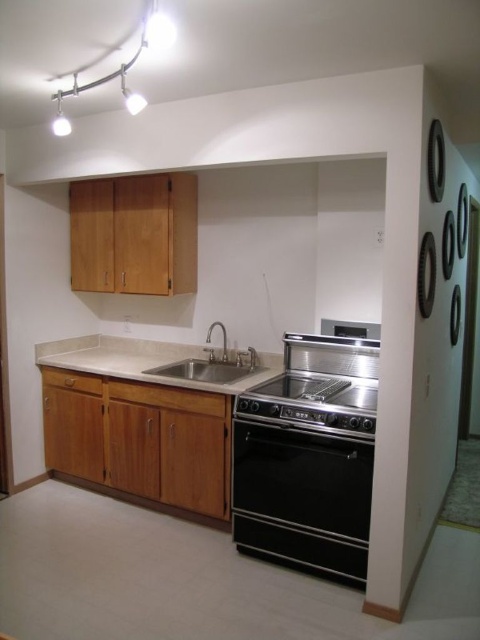
Can you confirm if stainless steel oven at center is shorter than satin steel sink at center?

Indeed, stainless steel oven at center has a lesser height compared to satin steel sink at center.

Is stainless steel oven at center wider than satin steel sink at center?

Indeed, stainless steel oven at center has a greater width compared to satin steel sink at center.

The height and width of the screenshot is (640, 480). I want to click on stainless steel oven at center, so click(312, 403).

Does satin steel sink at center appear on the right side of silver metallic faucet at center?

No, satin steel sink at center is not to the right of silver metallic faucet at center.

Does point (241, 365) come behind point (211, 328)?

No, it is in front of (211, 328).

At what (x,y) coordinates should I click in order to perform the action: click on satin steel sink at center. Please return your answer as a coordinate pair (x, y). The image size is (480, 640). Looking at the image, I should click on (213, 364).

Does black stainless steel oven at center lie in front of silver metallic faucet at center?

Yes, it is in front of silver metallic faucet at center.

Can you confirm if black stainless steel oven at center is thinner than silver metallic faucet at center?

Incorrect, black stainless steel oven at center's width is not less than silver metallic faucet at center's.

Locate an element on the screen. The image size is (480, 640). black stainless steel oven at center is located at coordinates (301, 497).

The image size is (480, 640). I want to click on black stainless steel oven at center, so click(301, 497).